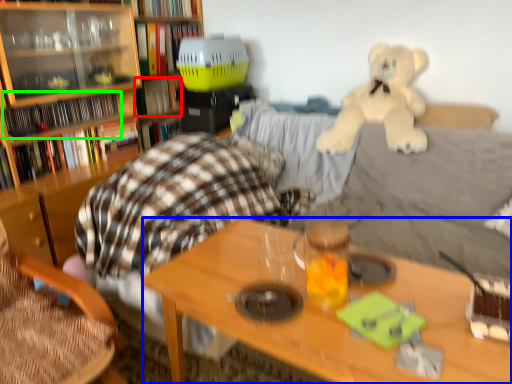
Question: Which object is positioned farthest from book (highlighted by a red box)? Select from desk (highlighted by a blue box) and book (highlighted by a green box).

Choices:
 (A) desk
 (B) book

Answer: (A)